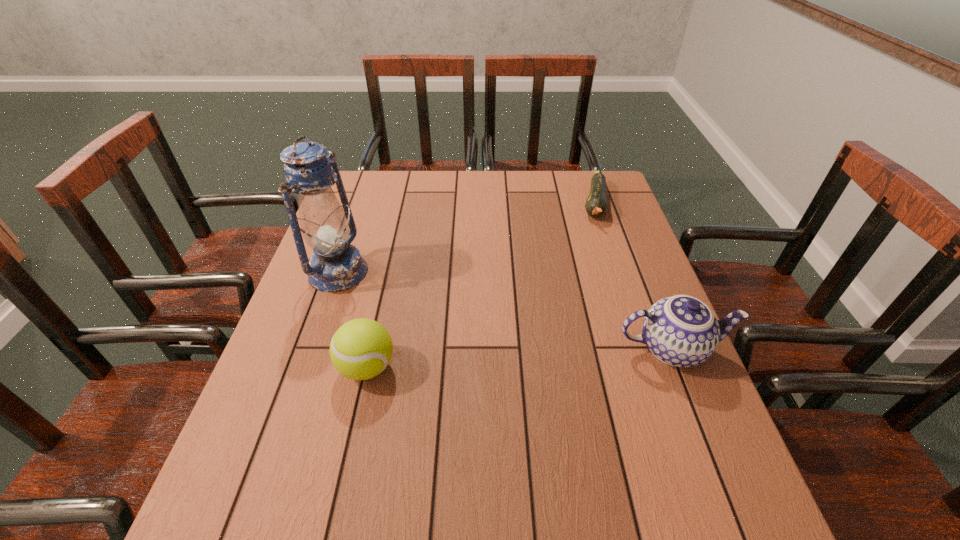
The image size is (960, 540). I want to click on free space between the farthest object and the second tallest object, so click(x=634, y=276).

Locate an element on the screen. This screenshot has height=540, width=960. empty location between the farthest object and the chinaware is located at coordinates coord(634,276).

Where is `free spot between the third nearest object and the chinaware`? Image resolution: width=960 pixels, height=540 pixels. free spot between the third nearest object and the chinaware is located at coordinates (505, 310).

Where is `vacant space in between the lantern and the chinaware`? This screenshot has width=960, height=540. vacant space in between the lantern and the chinaware is located at coordinates (505, 310).

Locate which object is the second closest to the third shortest object. Please provide its 2D coordinates. Your answer should be formatted as a tuple, i.e. [(x, y)], where the tuple contains the x and y coordinates of a point satisfying the conditions above.

[(361, 349)]

Locate which object is the second closest to the farthest object. Please provide its 2D coordinates. Your answer should be formatted as a tuple, i.e. [(x, y)], where the tuple contains the x and y coordinates of a point satisfying the conditions above.

[(335, 265)]